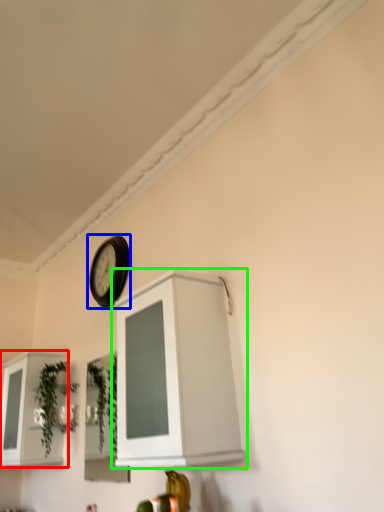
Question: Considering the real-world distances, which object is farthest from cabinetry (highlighted by a red box)? clock (highlighted by a blue box) or cabinetry (highlighted by a green box)?

Choices:
 (A) clock
 (B) cabinetry

Answer: (B)